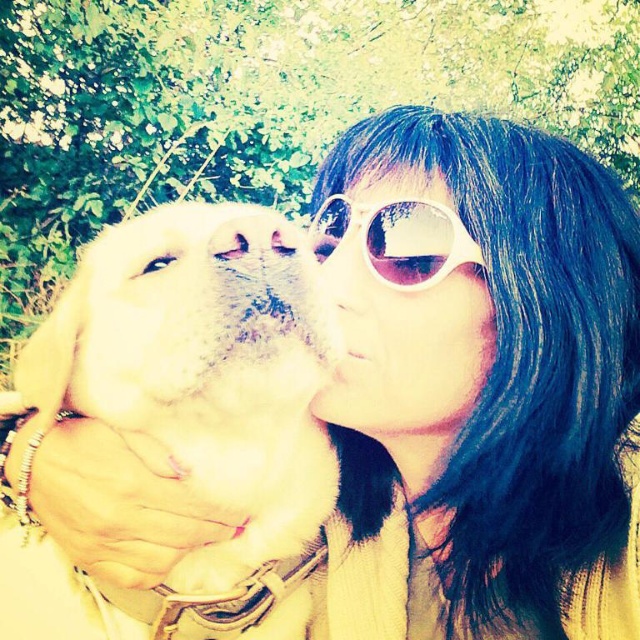
You are a photographer standing at the center of the scene. You want to take a portrait of the white fur dog at left. Considering the current distance between you and the dog, can you step back to ensure you are at least 24 inches away from the dog?

The white fur dog at left and viewer are 20.94 inches apart. Since 20.94 inches is less than 24 inches, you need to step back to increase the distance to at least 24 inches.

You are a photographer trying to capture a closeup of the white matte sunglasses at upper center without the white fur dog at left appearing too large in the frame. Based on their sizes, will the dog occupy more or less space in the photo compared to the sunglasses?

The white fur dog at left is bigger than the white matte sunglasses at upper center, so the dog will occupy more space in the photo compared to the sunglasses.

Based on the scene description, where is the white fur dog at left positioned in relation to the person?

The white fur dog at left is positioned at point 0.656 on the x axis and 0.286 on the y axis relative to the person.